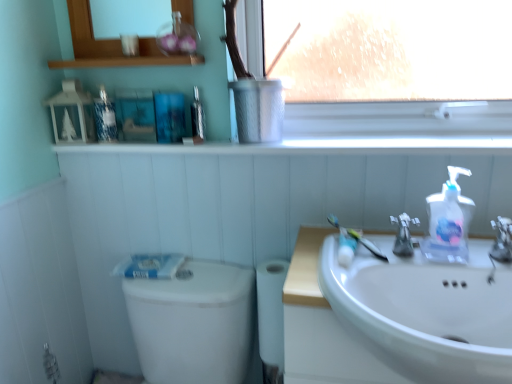
This screenshot has width=512, height=384. Identify the location of free space to the right of metallic silver mouthwash at upper center, the second mouthwash from the left. (250, 140).